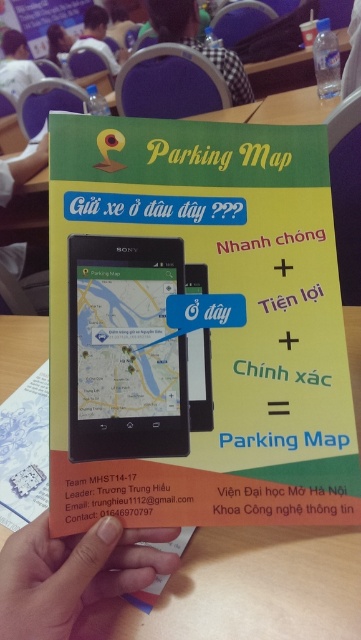
Question: Is black checkered shirt at upper center behind matte plastic hand at lower left?

Choices:
 (A) no
 (B) yes

Answer: (B)

Question: Can you confirm if matte black smartphone at center is thinner than matte black phone at upper center?

Choices:
 (A) yes
 (B) no

Answer: (A)

Question: Does black checkered shirt at upper center have a larger size compared to matte black smartphone at center?

Choices:
 (A) no
 (B) yes

Answer: (B)

Question: Which point is farther to the camera?

Choices:
 (A) matte plastic hand at lower left
 (B) matte black phone at upper center

Answer: (B)

Question: Considering the real-world distances, which object is farthest from the clear plastic bottle at upper right?

Choices:
 (A) skinny orange card at lower center
 (B) matte white hand at center
 (C) matte black phone at center

Answer: (B)

Question: Estimate the real-world distances between objects in this image. Which object is farther from the matte black phone at center?

Choices:
 (A) skinny orange card at lower center
 (B) black checkered shirt at upper center
 (C) matte plastic hand at lower left
 (D) wooden table at center

Answer: (B)